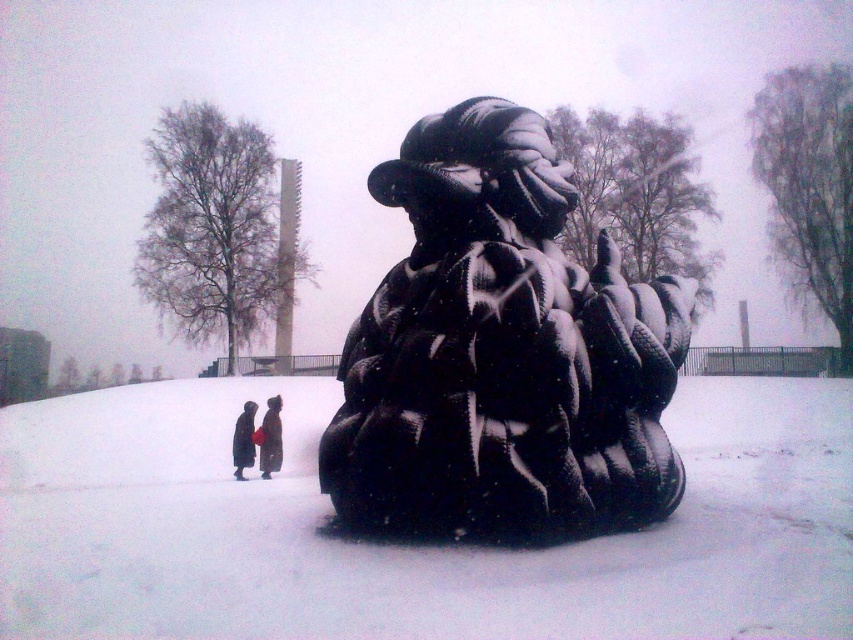
Question: Among these points, which one is farthest from the camera?

Choices:
 (A) (415, 406)
 (B) (270, 416)

Answer: (B)

Question: Is white matte snow at center to the right of dark brown fur coat at lower center from the viewer's perspective?

Choices:
 (A) no
 (B) yes

Answer: (B)

Question: Does sculpture at center have a larger size compared to dark brown fur coat at lower center?

Choices:
 (A) yes
 (B) no

Answer: (A)

Question: Which object is the farthest from the dark brown coat at center?

Choices:
 (A) white matte snow at center
 (B) dark brown fur coat at lower center
 (C) sculpture at center

Answer: (C)

Question: Is sculpture at center in front of dark brown fur coat at lower center?

Choices:
 (A) yes
 (B) no

Answer: (A)

Question: Which object is the closest to the sculpture at center?

Choices:
 (A) white matte snow at center
 (B) dark brown fur coat at lower center

Answer: (A)